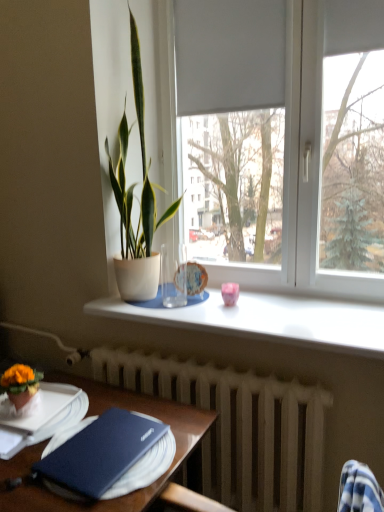
Where is `vacant space behind matte blue hardback book at lower left`? Image resolution: width=384 pixels, height=512 pixels. vacant space behind matte blue hardback book at lower left is located at coordinates (120, 404).